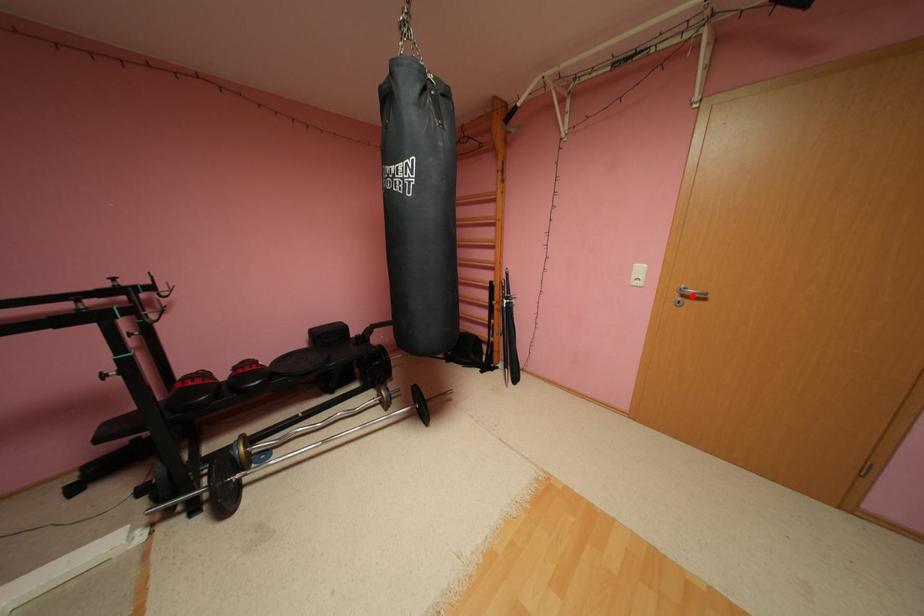
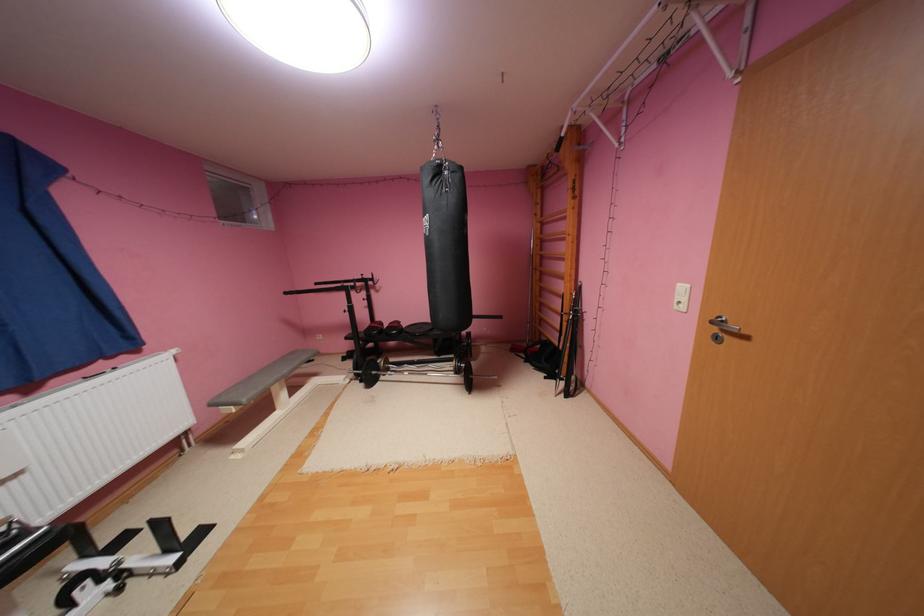
The point at the highlighted location is marked in the first image. Where is the corresponding point in the second image?

(733, 330)